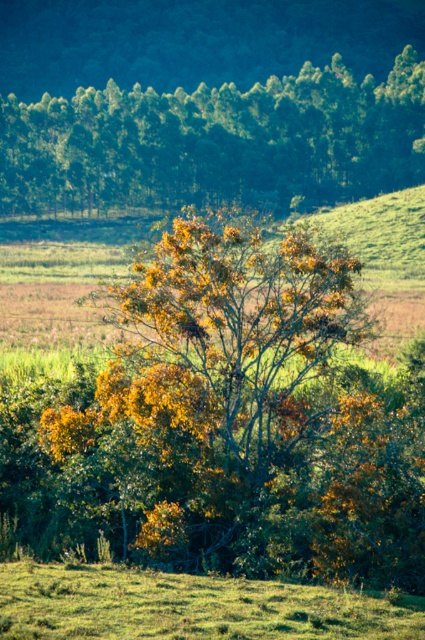
You are standing at the point with coordinates (x=217, y=141) in the image. What object is located at this point?

The yellow green leafy tree at upper center is located at point (x=217, y=141).